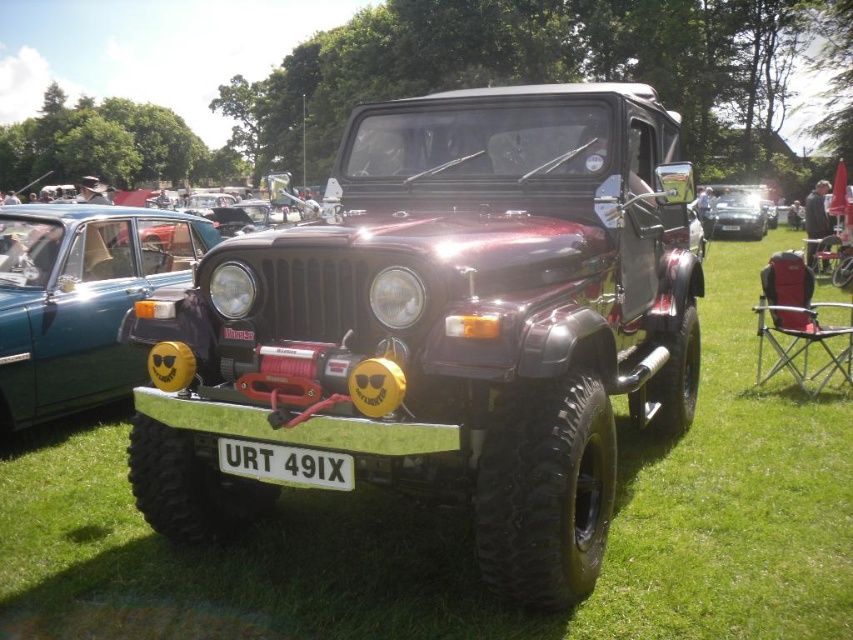
Question: Is white plastic license plate at center thinner than satin black car at center?

Choices:
 (A) yes
 (B) no

Answer: (B)

Question: Observing the image, what is the correct spatial positioning of metallic blue car at left in reference to white plastic license plate at center?

Choices:
 (A) right
 (B) left

Answer: (B)

Question: Which object is closer to the camera taking this photo?

Choices:
 (A) satin black car at center
 (B) white plastic license plate at center

Answer: (B)

Question: Which of these objects is positioned farthest from the satin black car at center?

Choices:
 (A) white plastic license plate at center
 (B) metallic blue car at left

Answer: (A)

Question: Does white plastic license plate at center have a smaller size compared to satin black car at center?

Choices:
 (A) no
 (B) yes

Answer: (B)

Question: Among these points, which one is farthest from the camera?

Choices:
 (A) (752, 225)
 (B) (250, 458)
 (C) (74, 246)

Answer: (A)